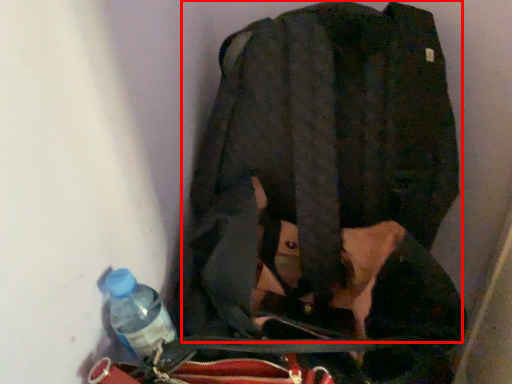
Question: From the image's perspective, where is jacket (annotated by the red box) located relative to bottle?

Choices:
 (A) above
 (B) below

Answer: (A)